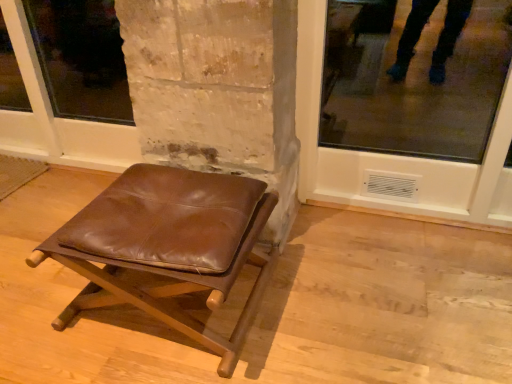
Image resolution: width=512 pixels, height=384 pixels. What are the coordinates of `brown leather stool at center` in the screenshot? It's located at (167, 245).

The image size is (512, 384). What do you see at coordinates (167, 245) in the screenshot?
I see `brown leather stool at center` at bounding box center [167, 245].

At what (x,y) coordinates should I click in order to perform the action: click on brown leather stool at center. Please return your answer as a coordinate pair (x, y). This screenshot has height=384, width=512. Looking at the image, I should click on (167, 245).